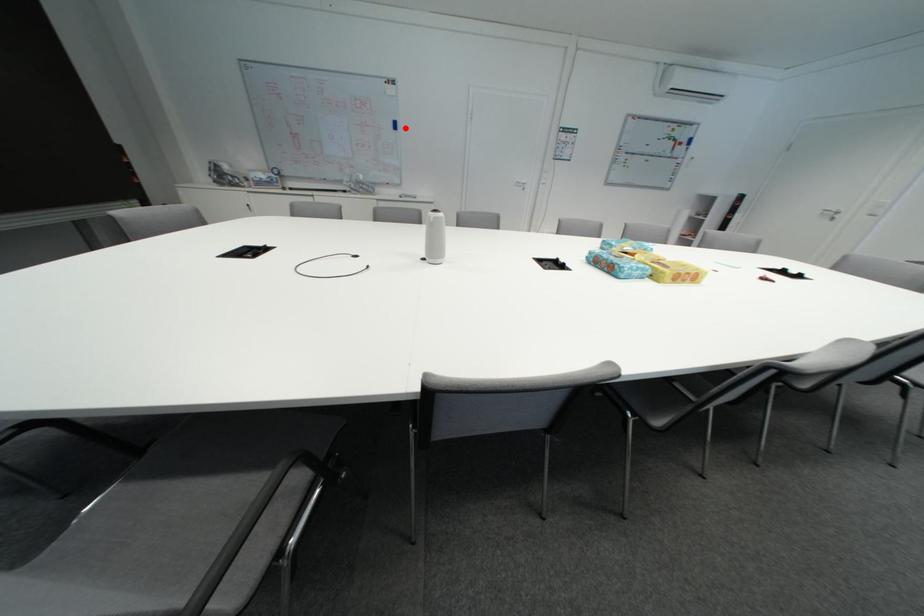
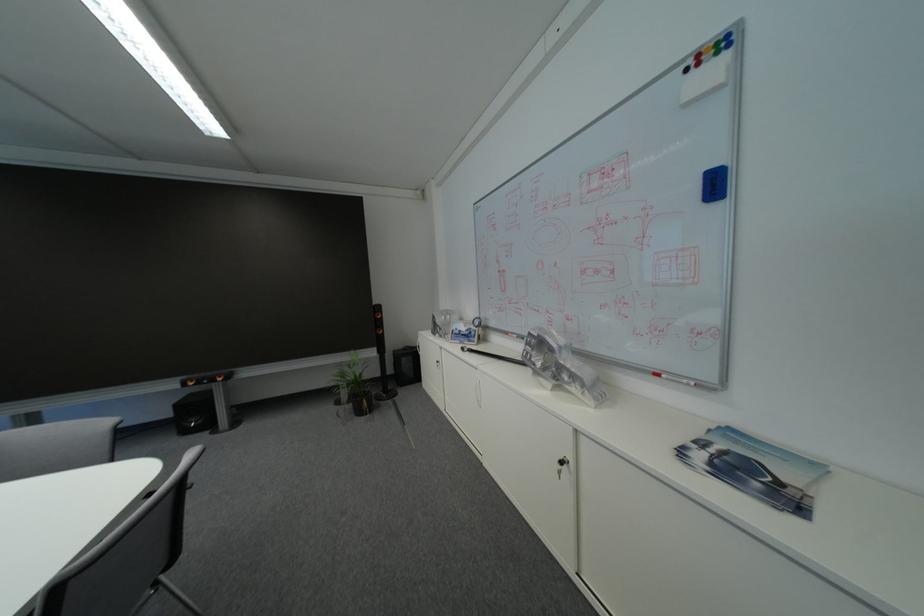
Locate, in the second image, the point that corresponds to the highlighted location in the first image.

(726, 188)